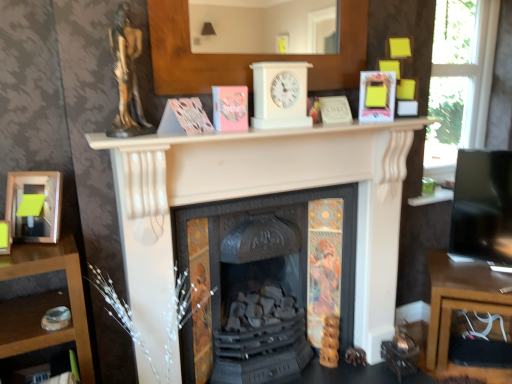
Describe the element at coordinates (264, 282) in the screenshot. I see `black cast iron fireplace at center, which is counted as the 1th fireplace, starting from the back` at that location.

Describe the element at coordinates (34, 205) in the screenshot. I see `matte black picture frame at left` at that location.

This screenshot has height=384, width=512. What do you see at coordinates (191, 115) in the screenshot? I see `pink matte paper at center, positioned as the 1th paperback book in left-to-right order` at bounding box center [191, 115].

Where is `wooden desk at lower right`? Image resolution: width=512 pixels, height=384 pixels. wooden desk at lower right is located at coordinates (460, 300).

The width and height of the screenshot is (512, 384). Find the location of `transparent glass window at upper right`. transparent glass window at upper right is located at coordinates (460, 78).

The image size is (512, 384). I want to click on white matte fireplace at center, the 1th fireplace viewed from the front, so click(x=261, y=195).

From a real-world perspective, which is physically above, hardcover book at upper right, positioned as the 1th paperback book in right-to-left order, or wooden desk at lower right?

hardcover book at upper right, positioned as the 1th paperback book in right-to-left order, from a real-world perspective.

How many degrees apart are the facing directions of hardcover book at upper right, positioned as the 1th paperback book in right-to-left order, and wooden desk at lower right?

The facing directions of hardcover book at upper right, positioned as the 1th paperback book in right-to-left order, and wooden desk at lower right are 1.78 degrees apart.

Which of these two, hardcover book at upper right, positioned as the 1th paperback book in right-to-left order, or wooden desk at lower right, is thinner?

hardcover book at upper right, positioned as the 1th paperback book in right-to-left order.

Between point (26, 239) and point (245, 112), which one is positioned in front?

The point (26, 239) is in front.

From the image's perspective, which is above, matte black picture frame at left or pink matte paper at center, positioned as the third paperback book in right-to-left order?

From the image's view, pink matte paper at center, positioned as the third paperback book in right-to-left order, is above.

Relative to pink matte paper at center, positioned as the third paperback book in right-to-left order, is matte black picture frame at left in front or behind?

In the image, matte black picture frame at left appears in front of pink matte paper at center, positioned as the third paperback book in right-to-left order.

Is matte black picture frame at left positioned with its back to pink matte paper at center, which appears as the second paperback book when viewed from the left?

No, matte black picture frame at left's orientation is not away from pink matte paper at center, which appears as the second paperback book when viewed from the left.

Find the location of a particular element. Image resolution: width=512 pixels, height=384 pixels. picture frame in front of the pink matte paper at center, positioned as the 1th paperback book in left-to-right order is located at coordinates (34, 205).

Does pink matte paper at center, arranged as the 4th paperback book when viewed from the right, appear on the right side of matte black picture frame at left?

Yes, pink matte paper at center, arranged as the 4th paperback book when viewed from the right, is to the right of matte black picture frame at left.

From the image's perspective, which object appears higher, pink matte paper at center, positioned as the 1th paperback book in left-to-right order, or matte black picture frame at left?

pink matte paper at center, positioned as the 1th paperback book in left-to-right order, is shown above in the image.

Between point (204, 132) and point (26, 239), which one is positioned in front?

The point (26, 239) is closer.

From a real-world perspective, is matte black picture frame at left under hardcover book at upper right, the fourth paperback book from the left?

Yes, from a real-world perspective, matte black picture frame at left is below hardcover book at upper right, the fourth paperback book from the left.

Which object is positioned more to the right, matte black picture frame at left or hardcover book at upper right, positioned as the 1th paperback book in right-to-left order?

Positioned to the right is hardcover book at upper right, positioned as the 1th paperback book in right-to-left order.

The width and height of the screenshot is (512, 384). Find the location of `picture frame that is in front of the hardcover book at upper right, positioned as the 1th paperback book in right-to-left order`. picture frame that is in front of the hardcover book at upper right, positioned as the 1th paperback book in right-to-left order is located at coordinates (34, 205).

What's the angular difference between matte black picture frame at left and hardcover book at upper right, positioned as the 1th paperback book in right-to-left order,'s facing directions?

The facing directions of matte black picture frame at left and hardcover book at upper right, positioned as the 1th paperback book in right-to-left order, are 10.6 degrees apart.

Would you say matte black picture frame at left is to the left or to the right of gold metallic statue at upper left in the picture?

Clearly, matte black picture frame at left is on the left of gold metallic statue at upper left in the image.

From a real-world perspective, which object rests below the other?

matte black picture frame at left.

Is point (29, 223) farther from camera compared to point (140, 45)?

No, (29, 223) is in front of (140, 45).

Can you tell me how much matte black picture frame at left and gold metallic statue at upper left differ in facing direction?

The angle between the facing direction of matte black picture frame at left and the facing direction of gold metallic statue at upper left is 64.3 degrees.

Which object is thinner, black cast iron fireplace at center, the 2th fireplace in the front-to-back sequence, or gold metallic statue at upper left?

gold metallic statue at upper left.

Is point (262, 359) positioned after point (133, 127)?

Yes.

In order to click on fireplace that is the 2nd object directly below the gold metallic statue at upper left (from a real-world perspective) in this screenshot , I will do `click(264, 282)`.

Is black cast iron fireplace at center, which is counted as the 1th fireplace, starting from the back, inside the boundaries of gold metallic statue at upper left, or outside?

black cast iron fireplace at center, which is counted as the 1th fireplace, starting from the back, lies outside gold metallic statue at upper left.

Considering the points (348, 115) and (125, 10), which point is behind, point (348, 115) or point (125, 10)?

The point (348, 115) is behind.

From a real-world perspective, does matte white book at center, positioned as the third paperback book in left-to-right order, sit lower than gold metallic statue at upper left?

Indeed, from a real-world perspective, matte white book at center, positioned as the third paperback book in left-to-right order, is positioned beneath gold metallic statue at upper left.

In the scene shown: Measure the distance from matte white book at center, marked as the second paperback book in a right-to-left arrangement, to gold metallic statue at upper left.

29.49 inches.

Does matte white book at center, marked as the second paperback book in a right-to-left arrangement, lie in front of gold metallic statue at upper left?

That is False.

Find the location of a particular element. desk below the hardcover book at upper right, positioned as the 1th paperback book in right-to-left order (from a real-world perspective) is located at coordinates (460, 300).

Where is `picture frame on the left of pink matte paper at center, positioned as the third paperback book in right-to-left order`? picture frame on the left of pink matte paper at center, positioned as the third paperback book in right-to-left order is located at coordinates (34, 205).

Looking at the image, which one is located further to transparent glass window at upper right, gold metallic statue at upper left or white plastic clock at center?

gold metallic statue at upper left is further to transparent glass window at upper right.

Based on the photo, from the image, which object appears to be nearer to matte white book at center, positioned as the third paperback book in left-to-right order, white matte fireplace at center, the 1th fireplace viewed from the front, or pink matte paper at center, positioned as the 1th paperback book in left-to-right order?

white matte fireplace at center, the 1th fireplace viewed from the front.

Looking at the image, which one is located closer to matte black picture frame at left, black cast iron fireplace at center, the 2th fireplace in the front-to-back sequence, or white plastic clock at center?

white plastic clock at center lies closer to matte black picture frame at left than the other object.

Estimate the real-world distances between objects in this image. Which object is further from hardcover book at upper right, positioned as the 1th paperback book in right-to-left order, black cast iron fireplace at center, the 2th fireplace in the front-to-back sequence, or gold metallic statue at upper left?

gold metallic statue at upper left lies further to hardcover book at upper right, positioned as the 1th paperback book in right-to-left order, than the other object.

When comparing their distances from gold metallic statue at upper left, does matte black picture frame at left or wooden desk at lower right seem closer?

The object closer to gold metallic statue at upper left is matte black picture frame at left.

Which object lies nearer to the anchor point pink matte paper at center, which appears as the second paperback book when viewed from the left, hardcover book at upper right, positioned as the 1th paperback book in right-to-left order, or white matte fireplace at center, which is counted as the 2th fireplace, starting from the back?

white matte fireplace at center, which is counted as the 2th fireplace, starting from the back, is positioned closer to the anchor pink matte paper at center, which appears as the second paperback book when viewed from the left.

Based on their spatial positions, is wooden desk at lower right or transparent glass window at upper right further from white plastic clock at center?

transparent glass window at upper right.

Considering their positions, is wooden desk at lower right positioned further to pink matte paper at center, arranged as the 4th paperback book when viewed from the right, than white matte fireplace at center, which is counted as the 2th fireplace, starting from the back?

wooden desk at lower right is further to pink matte paper at center, arranged as the 4th paperback book when viewed from the right.

What are the coordinates of `fireplace between pink matte paper at center, which appears as the second paperback book when viewed from the left, and black cast iron fireplace at center, which is counted as the 1th fireplace, starting from the back, from top to bottom` in the screenshot? It's located at (261, 195).

Locate an element on the screen. clock located between pink matte paper at center, arranged as the 4th paperback book when viewed from the right, and hardcover book at upper right, positioned as the 1th paperback book in right-to-left order, in the left-right direction is located at coordinates (280, 95).

Locate an element on the screen. Image resolution: width=512 pixels, height=384 pixels. fireplace between matte black picture frame at left and white matte fireplace at center, the 1th fireplace viewed from the front, in the horizontal direction is located at coordinates (264, 282).

This screenshot has height=384, width=512. I want to click on clock situated between black cast iron fireplace at center, the 2th fireplace in the front-to-back sequence, and transparent glass window at upper right from left to right, so click(x=280, y=95).